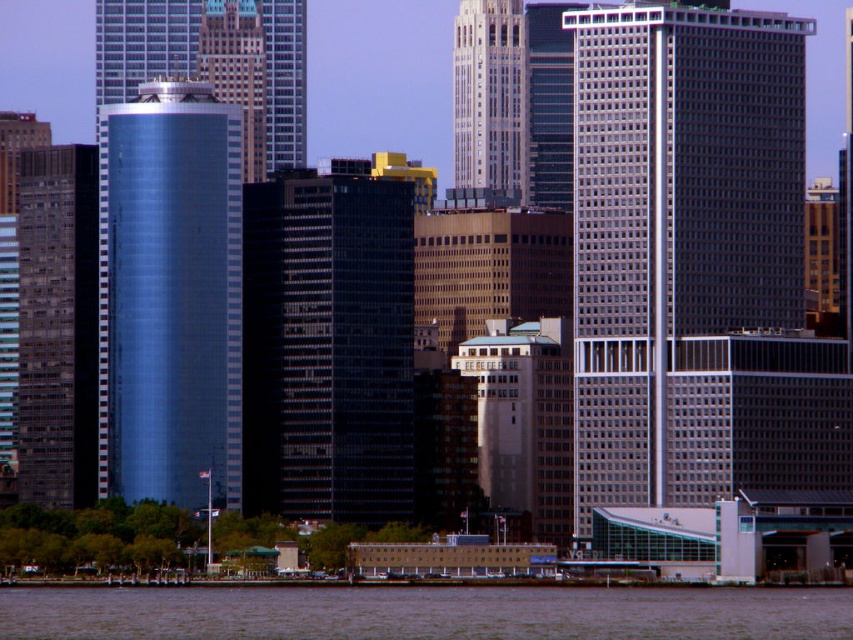
Question: Is gray glass skyscraper at center bigger than dark gray concrete building at left?

Choices:
 (A) yes
 (B) no

Answer: (A)

Question: Estimate the real-world distances between objects in this image. Which object is farther from the gold textured building at upper center?

Choices:
 (A) marble-like beige skyscraper at center
 (B) brown water at lower center
 (C) shiny metallic skyscraper at left
 (D) black glass building at center

Answer: (B)

Question: Estimate the real-world distances between objects in this image. Which object is closer to the gray glass skyscraper at center?

Choices:
 (A) shiny metallic skyscraper at left
 (B) brown water at lower center

Answer: (B)

Question: Is the position of black glass building at center less distant than that of dark gray concrete building at left?

Choices:
 (A) no
 (B) yes

Answer: (B)

Question: Considering the relative positions of black glass building at center and shiny metallic skyscraper at left in the image provided, where is black glass building at center located with respect to shiny metallic skyscraper at left?

Choices:
 (A) left
 (B) right

Answer: (B)

Question: Which point is farther to the camera?

Choices:
 (A) (202, 90)
 (B) (248, 465)
 (C) (463, 160)

Answer: (A)